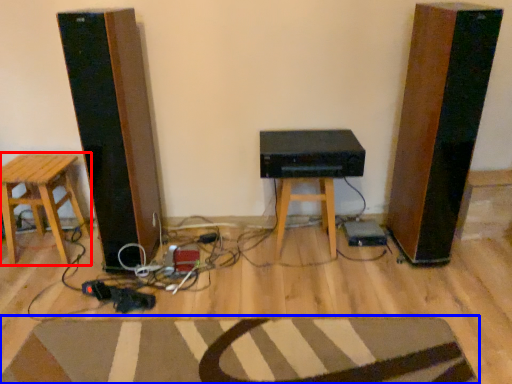
Question: Among these objects, which one is farthest to the camera, stool (highlighted by a red box) or doormat (highlighted by a blue box)?

Choices:
 (A) stool
 (B) doormat

Answer: (A)